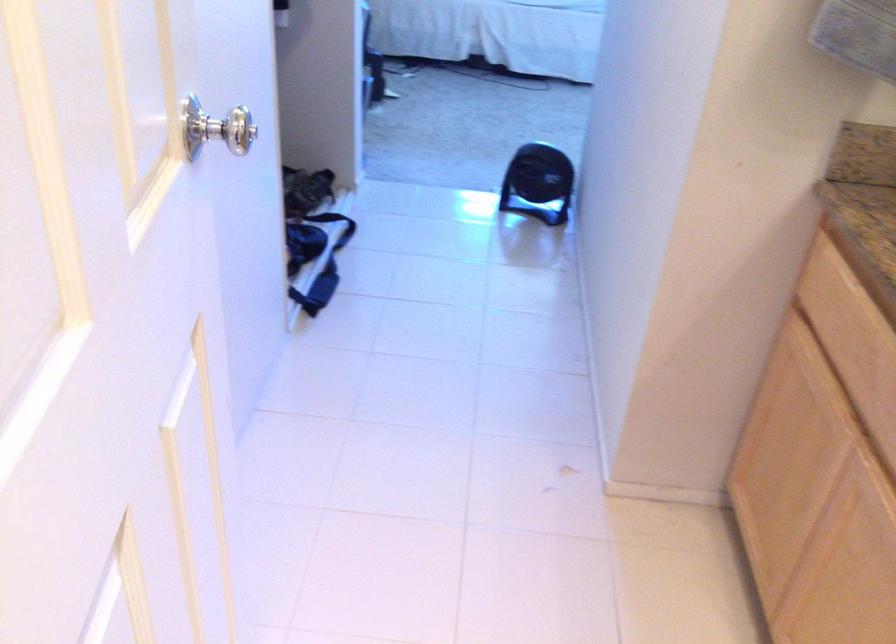
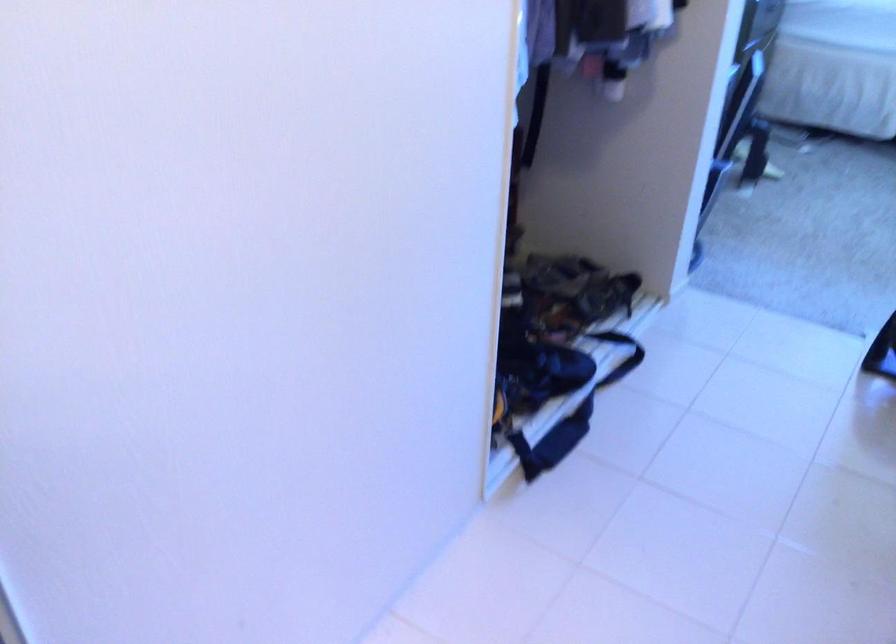
Question: How did the camera likely rotate?

Choices:
 (A) Left
 (B) Right
 (C) Up
 (D) Down

Answer: (A)